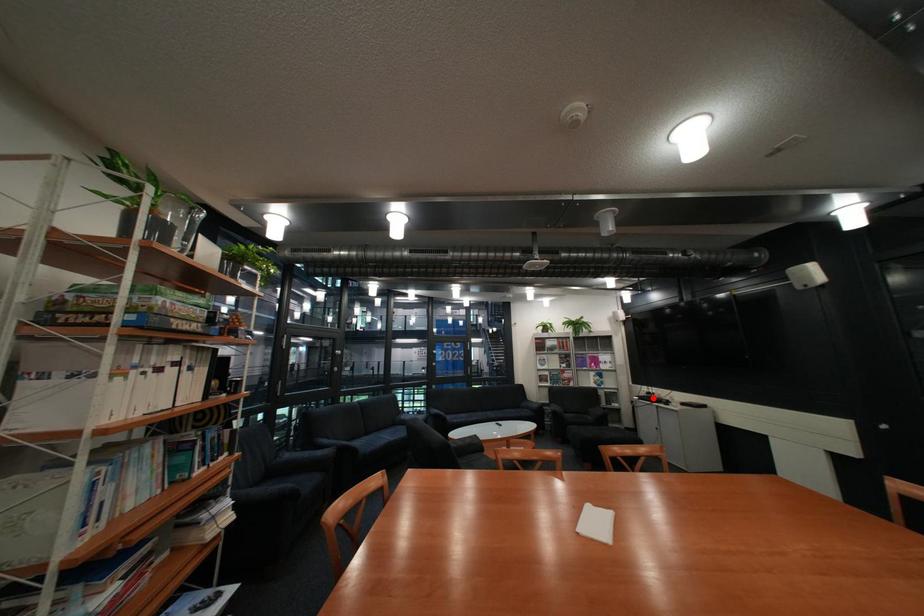
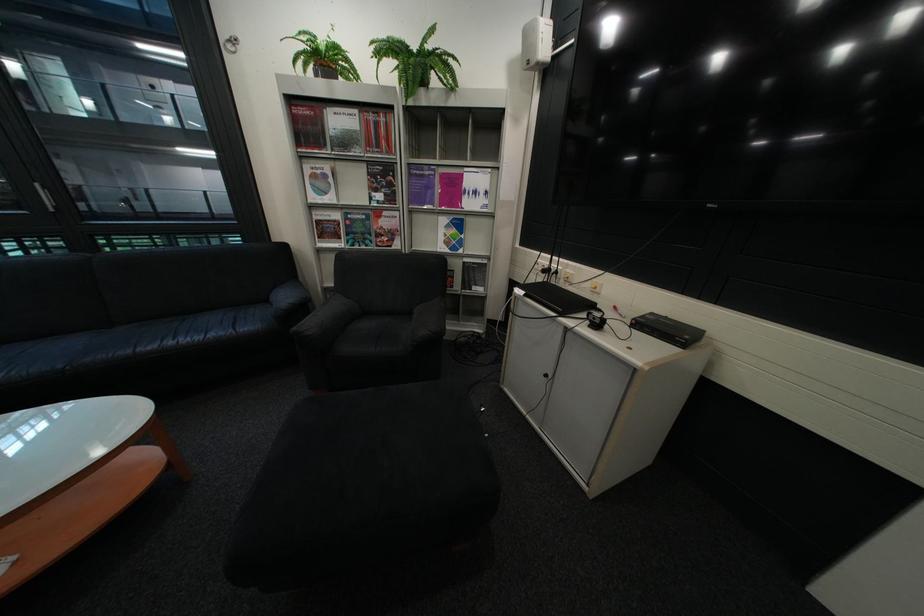
Where in the second image is the point corresponding to the highlighted location from the first image?

(538, 293)